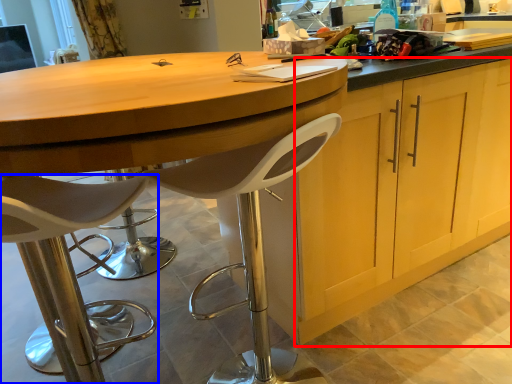
Question: Among these objects, which one is farthest to the camera, cabinetry (highlighted by a red box) or chair (highlighted by a blue box)?

Choices:
 (A) cabinetry
 (B) chair

Answer: (A)